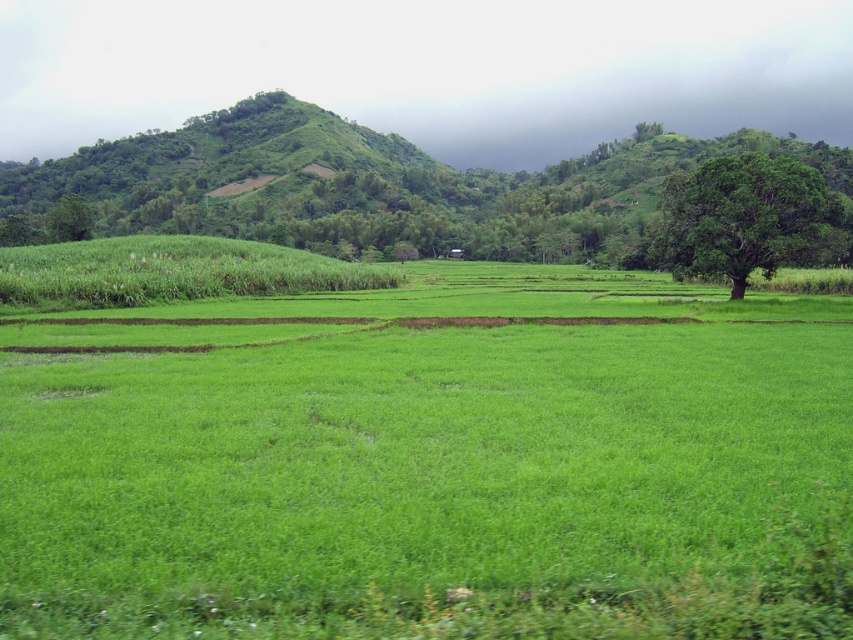
In the scene shown: Does green leafy tree at right appear under green leafy tree at left?

Indeed, green leafy tree at right is positioned under green leafy tree at left.

Is point (762, 211) closer to viewer compared to point (67, 236)?

That is True.

Image resolution: width=853 pixels, height=640 pixels. In order to click on green leafy tree at right in this screenshot , I will do `click(746, 218)`.

Measure the distance from green leafy hillside at left to green leafy tree at left.

The distance of green leafy hillside at left from green leafy tree at left is 87.42 meters.

Does point (799, 145) come in front of point (70, 220)?

That is False.

Locate an element on the screen. The height and width of the screenshot is (640, 853). green leafy hillside at left is located at coordinates (376, 188).

Who is lower down, green leafy hillside at left or green leafy tree at right?

green leafy tree at right is lower down.

You are a GUI agent. You are given a task and a screenshot of the screen. Output one action in this format:
    pyautogui.click(x=<x>, y=<y>)
    Task: Click on the green leafy hillside at left
    Image resolution: width=853 pixels, height=640 pixels.
    Given the screenshot: What is the action you would take?
    pyautogui.click(x=376, y=188)

At what (x,y) coordinates should I click in order to perform the action: click on green leafy hillside at left. Please return your answer as a coordinate pair (x, y). The height and width of the screenshot is (640, 853). Looking at the image, I should click on (376, 188).